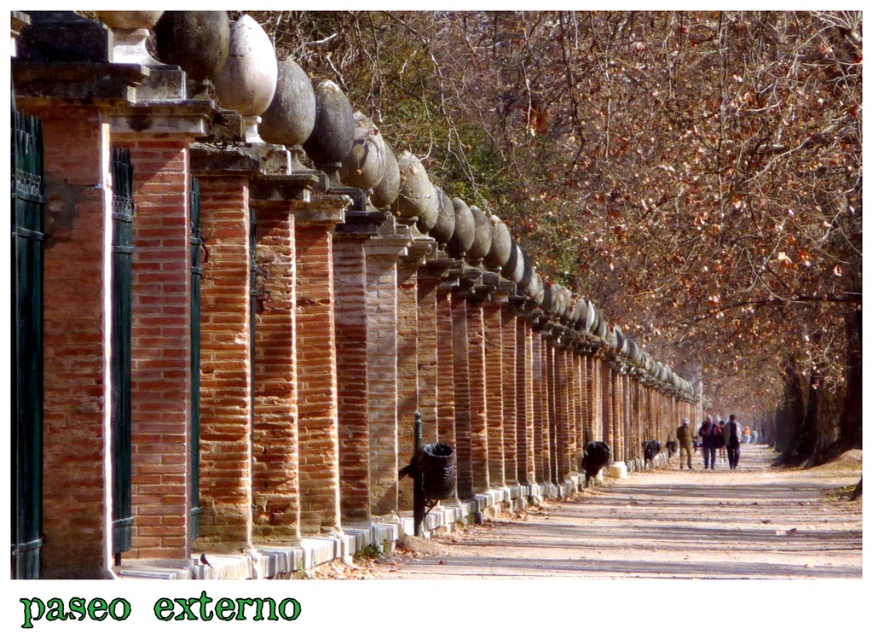
Question: Is brown textured wall at center wider than brown dirt path at center?

Choices:
 (A) yes
 (B) no

Answer: (A)

Question: Among these points, which one is farthest from the camera?

Choices:
 (A) (629, 556)
 (B) (688, 458)
 (C) (713, 464)

Answer: (C)

Question: Does brown dirt path at center appear over dark brown leather jacket at center-right?

Choices:
 (A) yes
 (B) no

Answer: (A)

Question: Which point is closer to the camera taking this photo?

Choices:
 (A) (445, 544)
 (B) (799, 340)
 (C) (737, 435)

Answer: (A)

Question: Considering the relative positions of brown dirt path at center and dark brown leather jacket at center-right in the image provided, where is brown dirt path at center located with respect to dark brown leather jacket at center-right?

Choices:
 (A) below
 (B) above

Answer: (B)

Question: Considering the real-world distances, which object is closest to the dark brown leather jacket at center-right?

Choices:
 (A) brown dirt path at center
 (B) brown textured wall at center
 (C) brown leather jacket at center-right

Answer: (C)